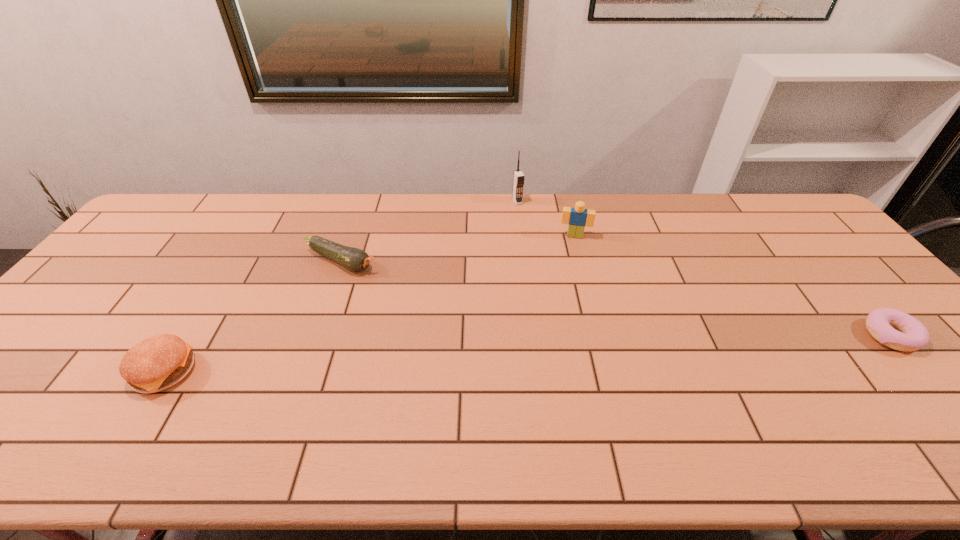
Locate an element on the screen. This screenshot has height=540, width=960. vacant space in between the zucchini and the shortest object is located at coordinates tap(615, 299).

The height and width of the screenshot is (540, 960). Find the location of `free space between the rightmost object and the zucchini`. free space between the rightmost object and the zucchini is located at coordinates click(615, 299).

You are a GUI agent. You are given a task and a screenshot of the screen. Output one action in this format:
    pyautogui.click(x=<x>, y=<y>)
    Task: Click on the free space between the hamburger and the Lego
    
    Given the screenshot: What is the action you would take?
    pyautogui.click(x=370, y=304)

Where is `free space between the fourth nearest object and the third tallest object`? Image resolution: width=960 pixels, height=540 pixels. free space between the fourth nearest object and the third tallest object is located at coordinates (370, 304).

Where is `vacant space that is in between the cellular telephone and the leftmost object`? The image size is (960, 540). vacant space that is in between the cellular telephone and the leftmost object is located at coordinates (341, 287).

The image size is (960, 540). What are the coordinates of `free space between the doughnut and the second object from left to right` in the screenshot? It's located at (615, 299).

At what (x,y) coordinates should I click in order to perform the action: click on vacant region between the zucchini and the Lego. Please return your answer as a coordinate pair (x, y). The width and height of the screenshot is (960, 540). Looking at the image, I should click on (458, 249).

You are a GUI agent. You are given a task and a screenshot of the screen. Output one action in this format:
    pyautogui.click(x=<x>, y=<y>)
    Task: Click on the empty space that is in between the doughnut and the fourth nearest object
    
    Given the screenshot: What is the action you would take?
    pyautogui.click(x=732, y=286)

Point out which object is positioned as the fourth nearest to the second object from left to right. Please provide its 2D coordinates. Your answer should be formatted as a tuple, i.e. [(x, y)], where the tuple contains the x and y coordinates of a point satisfying the conditions above.

[(912, 335)]

At what (x,y) coordinates should I click in order to perform the action: click on object that is the second closest to the second object from right to left. Please return your answer as a coordinate pair (x, y). Looking at the image, I should click on (354, 259).